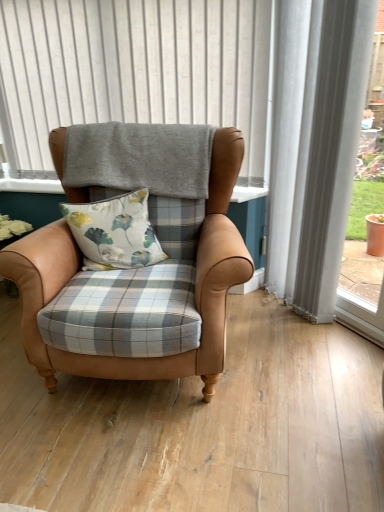
Question: Is floral fabric cushion at center to the left of leather armchair at center from the viewer's perspective?

Choices:
 (A) no
 (B) yes

Answer: (B)

Question: Is floral fabric cushion at center positioned behind leather armchair at center?

Choices:
 (A) yes
 (B) no

Answer: (A)

Question: Is floral fabric cushion at center surrounding leather armchair at center?

Choices:
 (A) yes
 (B) no

Answer: (B)

Question: Are floral fabric cushion at center and leather armchair at center located far from each other?

Choices:
 (A) no
 (B) yes

Answer: (A)

Question: Is floral fabric cushion at center with leather armchair at center?

Choices:
 (A) no
 (B) yes

Answer: (A)

Question: From a real-world perspective, does floral fabric cushion at center stand above leather armchair at center?

Choices:
 (A) yes
 (B) no

Answer: (A)

Question: Can you confirm if gray fabric at upper center is taller than leather armchair at center?

Choices:
 (A) yes
 (B) no

Answer: (B)

Question: Can you confirm if gray fabric at upper center is positioned to the right of leather armchair at center?

Choices:
 (A) no
 (B) yes

Answer: (A)

Question: Considering the relative sizes of gray fabric at upper center and leather armchair at center in the image provided, is gray fabric at upper center smaller than leather armchair at center?

Choices:
 (A) yes
 (B) no

Answer: (A)

Question: From the image's perspective, is gray fabric at upper center located above leather armchair at center?

Choices:
 (A) no
 (B) yes

Answer: (B)

Question: From a real-world perspective, is gray fabric at upper center physically above leather armchair at center?

Choices:
 (A) no
 (B) yes

Answer: (B)

Question: Is gray fabric at upper center looking in the opposite direction of leather armchair at center?

Choices:
 (A) no
 (B) yes

Answer: (A)

Question: Is the surface of floral fabric cushion at center in direct contact with gray fabric at upper center?

Choices:
 (A) no
 (B) yes

Answer: (A)